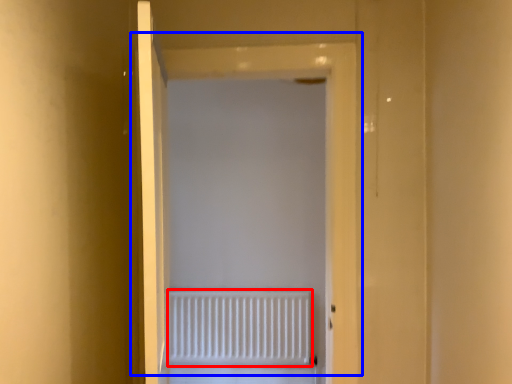
Question: Among these objects, which one is farthest to the camera, radiator (highlighted by a red box) or door (highlighted by a blue box)?

Choices:
 (A) radiator
 (B) door

Answer: (A)